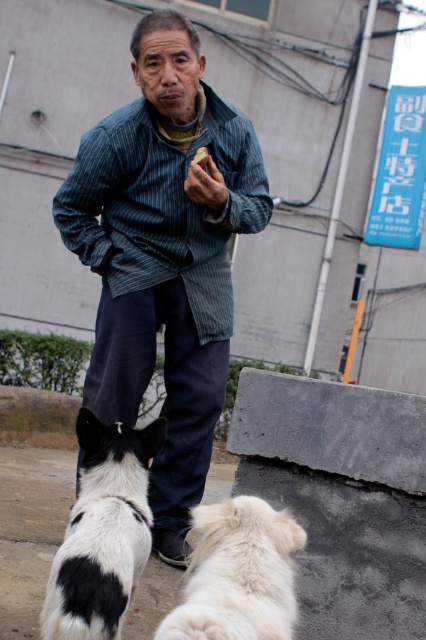
You are a photographer trying to capture a closeup of the striped fabric jacket at center and the white fluffy dog at lower center. Since you want to focus on both subjects equally, which subject should you zoom in on more to ensure they appear the same size in the photo?

The striped fabric jacket at center is bigger than the white fluffy dog at lower center, so you should zoom in more on the white fluffy dog at lower center to make them appear the same size in the photo.